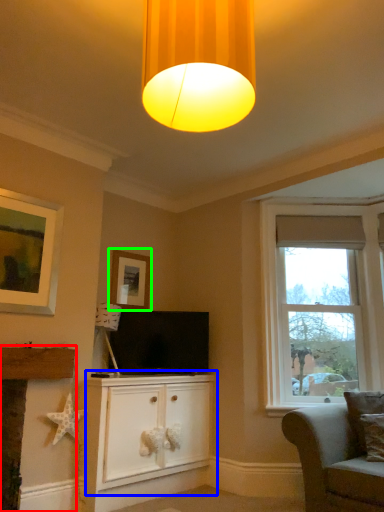
Question: Which object is positioned farthest from fireplace (highlighted by a red box)? Select from cabinetry (highlighted by a blue box) and picture frame (highlighted by a green box).

Choices:
 (A) cabinetry
 (B) picture frame

Answer: (B)